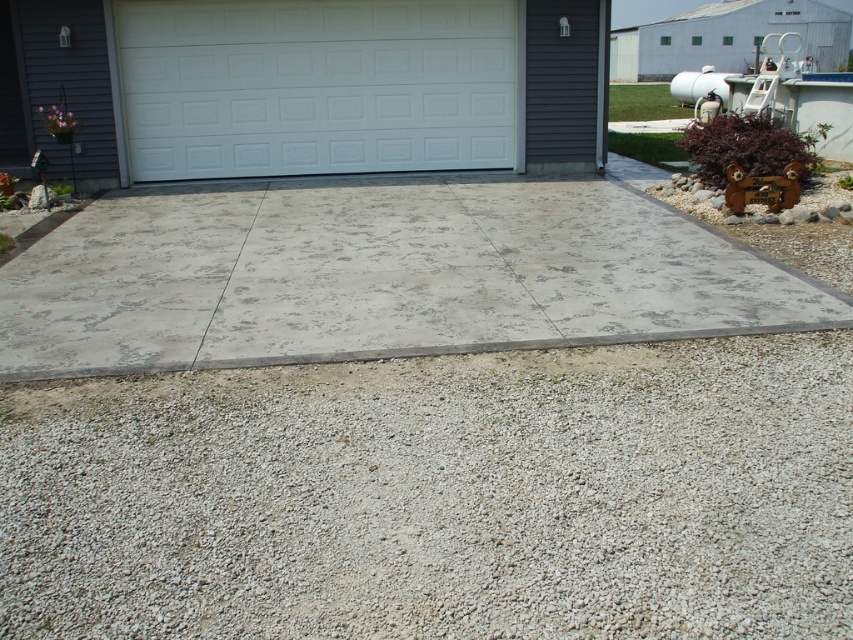
You are planning to install a new garden path and need to choose between the gray gravel at lower center and the gray concrete pavement at center. Which material would be more suitable if you want a surface with larger particles for better drainage?

The gray concrete pavement at center would be more suitable as it has a larger size compared to the gray gravel at lower center, providing better drainage due to its bigger particles.

You are standing on the gray concrete pavement at center and want to look over to the white painted wood garage door at center. Which object is taller?

The white painted wood garage door at center is taller than the gray concrete pavement at center.

You are a delivery person standing at the edge of the driveway. You need to place a package that requires a stable surface 8 meters away from the gray gravel at lower center. Can you place it near the white painted wood garage door at center?

The gray gravel at lower center is 7.88 meters away from the white painted wood garage door at center. Since the required distance is 8 meters, the package can be placed near the white painted wood garage door at center as it is approximately the correct distance from the gray gravel.